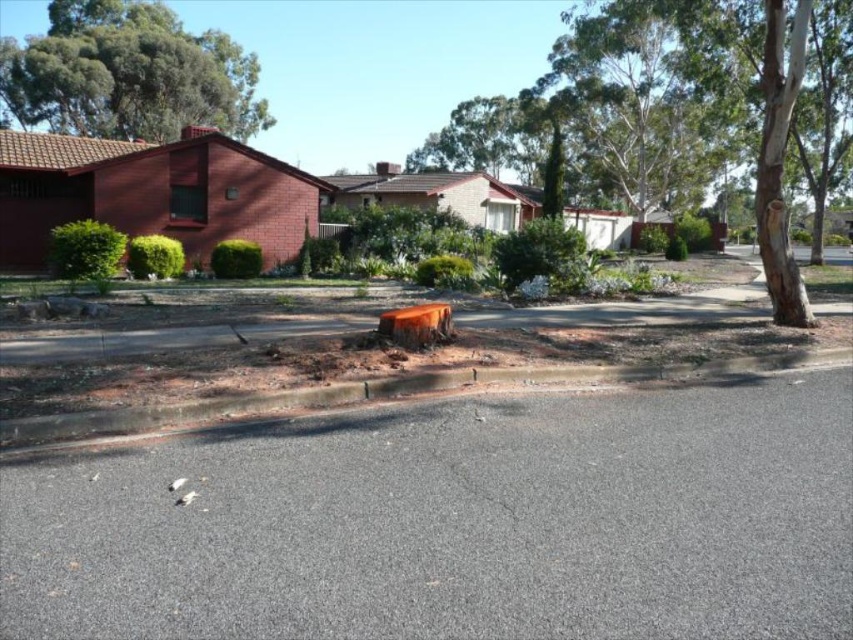
Question: Is smooth bark tree at center in front of green leafy tree at upper left?

Choices:
 (A) yes
 (B) no

Answer: (A)

Question: Which point is closer to the camera?

Choices:
 (A) green leafy tree at upper left
 (B) smooth bark tree at center

Answer: (B)

Question: Which point appears closest to the camera in this image?

Choices:
 (A) (151, 106)
 (B) (670, 32)

Answer: (B)

Question: Which object appears farthest from the camera in this image?

Choices:
 (A) smooth bark tree at center
 (B) green leafy tree at upper left

Answer: (B)

Question: Is smooth bark tree at center wider than green leafy tree at upper left?

Choices:
 (A) no
 (B) yes

Answer: (B)

Question: Is smooth bark tree at center wider than green leafy tree at upper left?

Choices:
 (A) yes
 (B) no

Answer: (A)